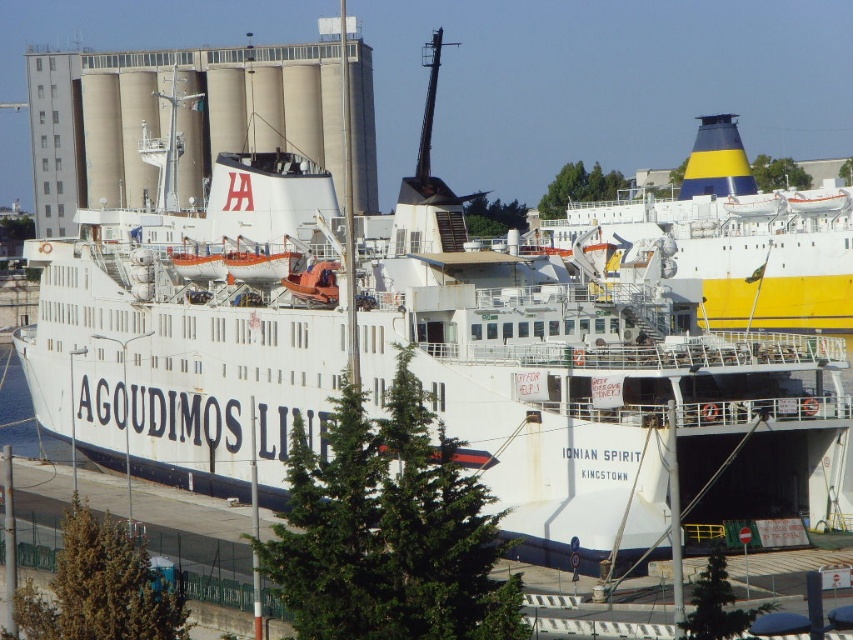
Based on the coordinates provided in the scene description, where is the yellow and blue painted ship at upper right located?

The yellow and blue painted ship at upper right is located at coordinates point (740, 240).

You are a crane operator tasked with lowering a cargo container from the yellow and blue painted ship at upper right to the blue water at lower left. The container is 4 meters long. Can you safely lower it directly without needing to move the container horizontally?

The yellow and blue painted ship at upper right is 48.13 meters from the blue water at lower left. Since the container is only 4 meters long, there is sufficient horizontal space to lower it directly without needing to move the container horizontally.